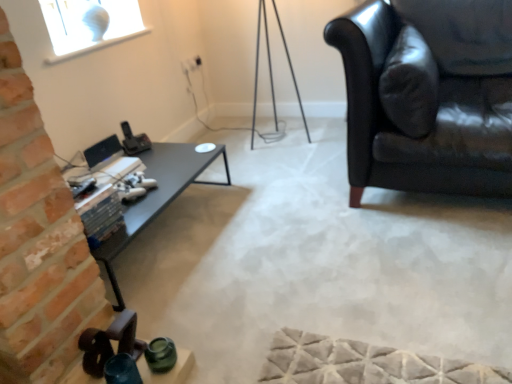
What do you see at coordinates (158, 195) in the screenshot?
I see `black glossy table at left` at bounding box center [158, 195].

What do you see at coordinates (432, 119) in the screenshot? Image resolution: width=512 pixels, height=384 pixels. I see `black leather couch at right` at bounding box center [432, 119].

In order to click on black glossy table at left in this screenshot , I will do `click(158, 195)`.

Does black leather couch at right have a lesser height compared to satin black monitor at center?

No.

Based on the photo, would you say black leather couch at right is a long distance from satin black monitor at center?

Yes, black leather couch at right is far from satin black monitor at center.

Where is `computer monitor that appears on the left of black leather couch at right`? computer monitor that appears on the left of black leather couch at right is located at coordinates (102, 150).

In the scene shown: Is satin black monitor at center in front of or behind black leather couch at right in the image?

Clearly, satin black monitor at center is behind black leather couch at right.

Find the location of a particular element. This screenshot has height=384, width=512. studio couch in front of the satin black monitor at center is located at coordinates (432, 119).

Is satin black monitor at center turned away from black leather couch at right?

No, black leather couch at right is not at the back of satin black monitor at center.

I want to click on table that appears below the black leather couch at right (from a real-world perspective), so click(158, 195).

Which object is closer to the camera taking this photo, black leather couch at right or black glossy table at left?

black leather couch at right is more forward.

Based on the photo, based on their sizes in the image, would you say black leather couch at right is bigger or smaller than black glossy table at left?

In the image, black leather couch at right appears to be larger than black glossy table at left.

From the image's perspective, between black leather couch at right and black glossy table at left, which one is located above?

black leather couch at right is shown above in the image.

Which of these two, satin black monitor at center or black glossy table at left, is smaller?

With smaller size is satin black monitor at center.

In terms of height, does satin black monitor at center look taller or shorter compared to black glossy table at left?

In the image, satin black monitor at center appears to be shorter than black glossy table at left.

From the picture: From a real-world perspective, which object rests below the other?

black glossy table at left, from a real-world perspective.

Do you think black glossy table at left is within black leather couch at right, or outside of it?

black glossy table at left is located beyond the bounds of black leather couch at right.

Is black glossy table at left positioned behind black leather couch at right?

Yes, it is behind black leather couch at right.

From a real-world perspective, between black glossy table at left and black leather couch at right, who is vertically lower?

black glossy table at left is physically lower.

Consider the image. Considering the positions of objects black glossy table at left and satin black monitor at center in the image provided, who is behind, black glossy table at left or satin black monitor at center?

satin black monitor at center is further from the camera.

Who is smaller, black glossy table at left or satin black monitor at center?

With smaller size is satin black monitor at center.

Does point (206, 165) come behind point (115, 142)?

That is False.

Which object is positioned more to the left, black glossy table at left or satin black monitor at center?

satin black monitor at center is more to the left.

Where is `computer monitor behind the black leather couch at right`? This screenshot has height=384, width=512. computer monitor behind the black leather couch at right is located at coordinates (102, 150).

Where is `computer monitor lying on the left of black leather couch at right`? computer monitor lying on the left of black leather couch at right is located at coordinates (102, 150).

Looking at the image, which one is located closer to black leather couch at right, black glossy table at left or satin black monitor at center?

black glossy table at left lies closer to black leather couch at right than the other object.

Looking at the image, which one is located further to black leather couch at right, satin black monitor at center or black glossy table at left?

satin black monitor at center.

Looking at this image, looking at the image, which one is located further to black glossy table at left, satin black monitor at center or black leather couch at right?

The object further to black glossy table at left is black leather couch at right.

From the image, which object appears to be farther from satin black monitor at center, black glossy table at left or black leather couch at right?

black leather couch at right.

Looking at the image, which one is located closer to satin black monitor at center, black leather couch at right or black glossy table at left?

The object closer to satin black monitor at center is black glossy table at left.

Looking at the image, which one is located closer to black glossy table at left, black leather couch at right or satin black monitor at center?

satin black monitor at center is closer to black glossy table at left.

You are a GUI agent. You are given a task and a screenshot of the screen. Output one action in this format:
    pyautogui.click(x=<x>, y=<y>)
    Task: Click on the table located between satin black monitor at center and black leather couch at right in the left-right direction
    
    Given the screenshot: What is the action you would take?
    pyautogui.click(x=158, y=195)